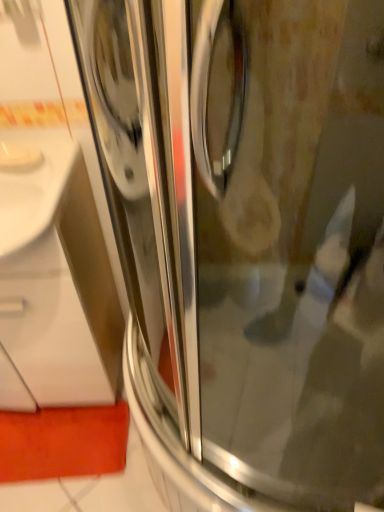
At what (x,y) coordinates should I click in order to perform the action: click on white glossy sink at left. Please return your answer as a coordinate pair (x, y). Looking at the image, I should click on (32, 184).

What do you see at coordinates (32, 184) in the screenshot?
I see `white glossy sink at left` at bounding box center [32, 184].

Find the location of `white glossy sink at left`. white glossy sink at left is located at coordinates (32, 184).